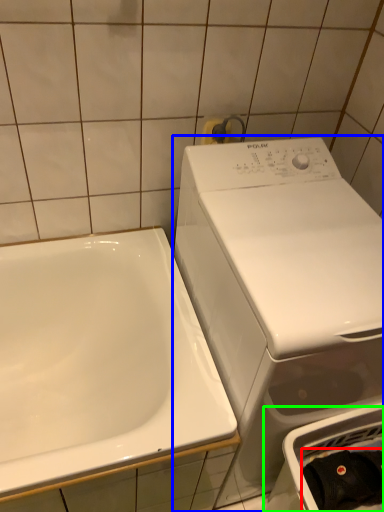
Question: Estimate the real-world distances between objects in this image. Which object is farther from clothing (highlighted by a red box), washing machine (highlighted by a blue box) or dish washer (highlighted by a green box)?

Choices:
 (A) washing machine
 (B) dish washer

Answer: (A)